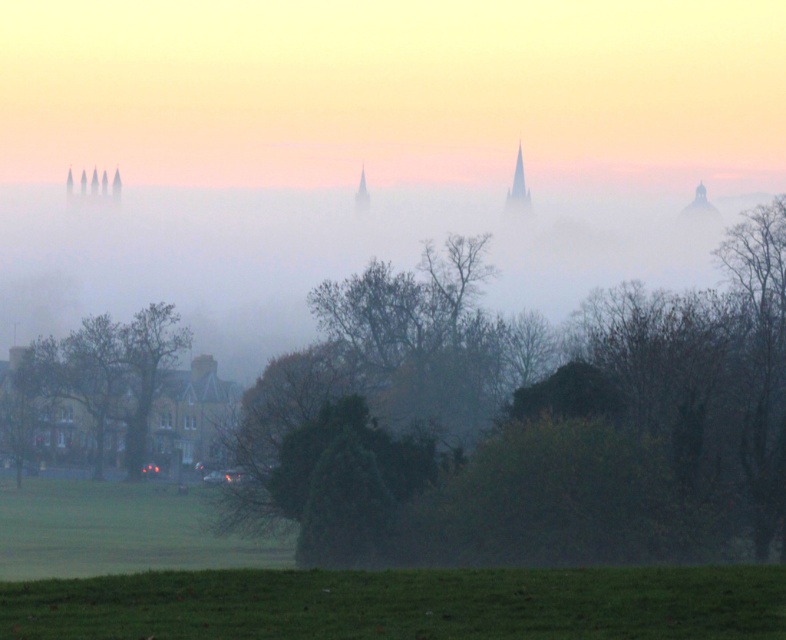
Question: Which object is positioned closest to the foggy misty atmosphere at center?

Choices:
 (A) smooth stone spire at center
 (B) smokey gray spire at upper center

Answer: (A)

Question: Which object is closer to the camera taking this photo?

Choices:
 (A) smokey gray spire at upper center
 (B) green matte tree at lower left
 (C) smooth stone spire at center

Answer: (B)

Question: Is the position of green matte tree at lower left less distant than that of smooth stone spire at center?

Choices:
 (A) no
 (B) yes

Answer: (B)

Question: Based on their relative distances, which object is nearer to the foggy misty atmosphere at center?

Choices:
 (A) smooth stone spire at center
 (B) smokey gray spire at upper center
 (C) green leafy tree at center
 (D) green matte tree at lower left

Answer: (A)

Question: Is green leafy tree at center in front of smooth stone spire at center?

Choices:
 (A) yes
 (B) no

Answer: (A)

Question: Can you confirm if green matte tree at lower left is smaller than smokey gray spire at upper center?

Choices:
 (A) no
 (B) yes

Answer: (A)